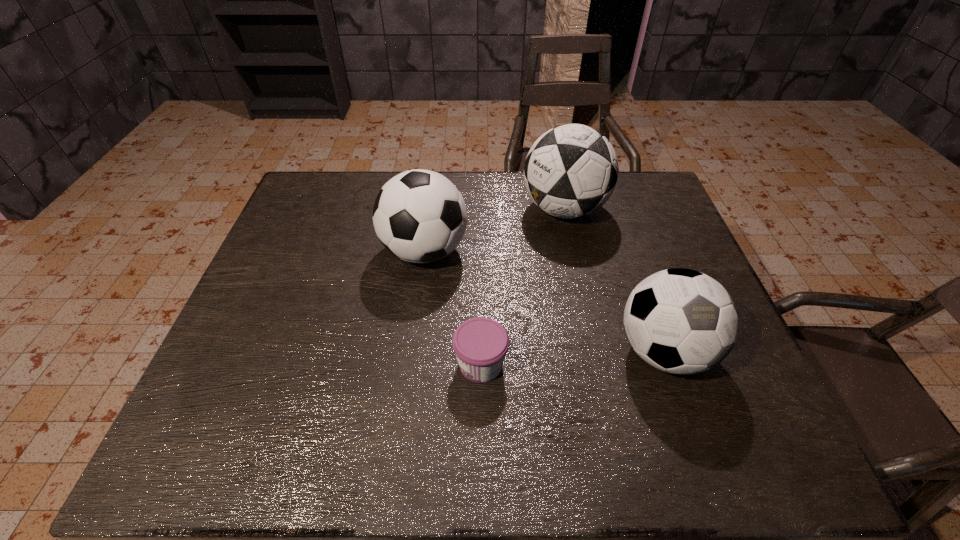
Where is `the leftmost soccer ball`? the leftmost soccer ball is located at coordinates (420, 216).

Find the location of a particular element. This screenshot has height=540, width=960. the nearest soccer ball is located at coordinates (681, 321).

What are the coordinates of `jam` in the screenshot? It's located at (480, 344).

Identify the location of free space located 0.110m on the right of the leftmost soccer ball. (508, 251).

You are a GUI agent. You are given a task and a screenshot of the screen. Output one action in this format:
    pyautogui.click(x=<x>, y=<y>)
    Task: Click on the free point located 0.140m on the main logo of the nearest soccer ball
    
    Given the screenshot: What is the action you would take?
    pyautogui.click(x=702, y=463)

Identify the location of vacant space situated 0.120m on the front label of the jam. (399, 364).

The image size is (960, 540). Identify the location of blank space located on the front label of the jam. (281, 364).

The width and height of the screenshot is (960, 540). What are the coordinates of `vacant space situated on the front label of the jam` in the screenshot? It's located at (372, 364).

The width and height of the screenshot is (960, 540). Identify the location of object located at the far edge. (570, 171).

At what (x,y) coordinates should I click in order to perform the action: click on object present at the right edge. Please return your answer as a coordinate pair (x, y). Looking at the image, I should click on (681, 321).